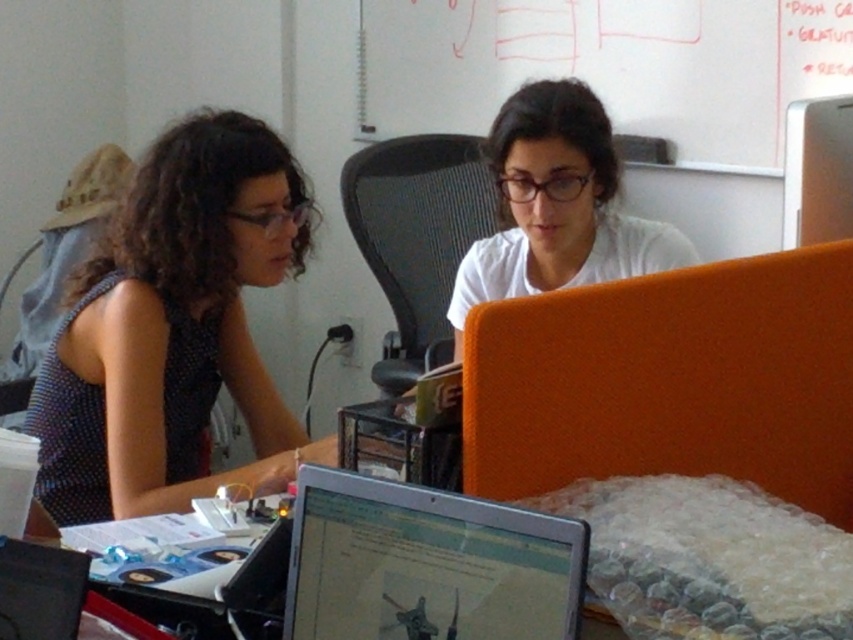
Question: Which point appears farthest from the camera in this image?

Choices:
 (A) (76, 605)
 (B) (778, 532)

Answer: (B)

Question: Is polka dot fabric shirt at left behind matte black laptop at lower left?

Choices:
 (A) no
 (B) yes

Answer: (B)

Question: Can you confirm if polka dot fabric shirt at left is positioned above metallic silver laptop at lower center?

Choices:
 (A) yes
 (B) no

Answer: (A)

Question: Is silver metallic laptop at center to the right of matte black laptop at lower left from the viewer's perspective?

Choices:
 (A) no
 (B) yes

Answer: (B)

Question: Which of these objects is positioned farthest from the white matte shirt at center?

Choices:
 (A) metallic silver laptop at lower center
 (B) matte black laptop at lower left
 (C) silver metallic laptop at center

Answer: (B)

Question: Which point is farther from the camera taking this photo?

Choices:
 (A) (573, 84)
 (B) (45, 632)

Answer: (A)